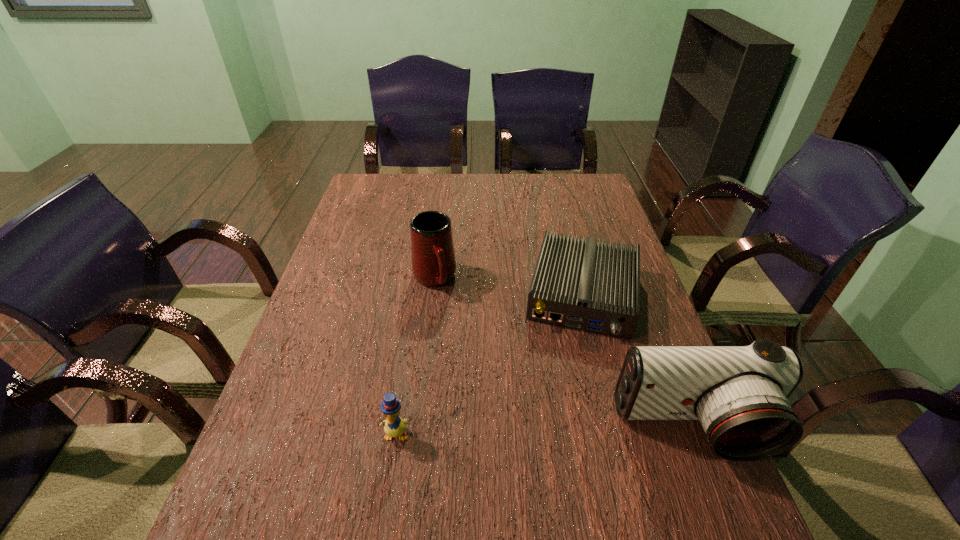
I want to click on free space located on the back panel of the router, so click(x=559, y=467).

Identify the location of object at the near edge. The height and width of the screenshot is (540, 960). (740, 394).

This screenshot has height=540, width=960. I want to click on camcorder that is at the right edge, so click(x=740, y=394).

Where is `router that is at the right edge`? Image resolution: width=960 pixels, height=540 pixels. router that is at the right edge is located at coordinates (587, 285).

Locate an element on the screen. object present at the near right corner is located at coordinates (740, 394).

You are a GUI agent. You are given a task and a screenshot of the screen. Output one action in this format:
    pyautogui.click(x=<x>, y=<y>)
    Task: Click on the vacant space at the far edge
    The height and width of the screenshot is (540, 960).
    Given the screenshot: What is the action you would take?
    pyautogui.click(x=420, y=173)

In the image, there is a desktop. At what (x,y) coordinates should I click in order to perform the action: click on vacant space at the left edge. Please return your answer as a coordinate pair (x, y). This screenshot has height=540, width=960. Looking at the image, I should click on (348, 240).

This screenshot has height=540, width=960. Identify the location of vacant region at the right edge of the desktop. (607, 236).

In order to click on blank area at the far left corner in this screenshot , I will do `click(371, 191)`.

The height and width of the screenshot is (540, 960). In order to click on vacant space at the far right corner of the desktop in this screenshot , I will do `click(565, 181)`.